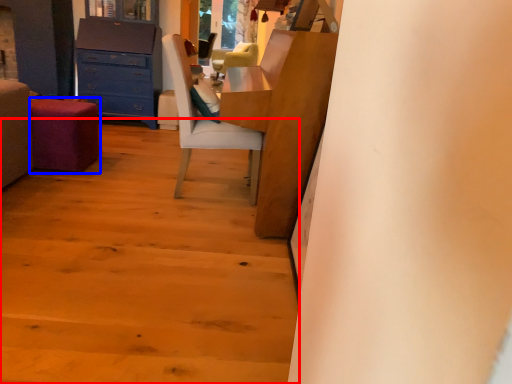
Question: Which of the following is the closest to the observer, stairwell (highlighted by a red box) or stool (highlighted by a blue box)?

Choices:
 (A) stairwell
 (B) stool

Answer: (A)